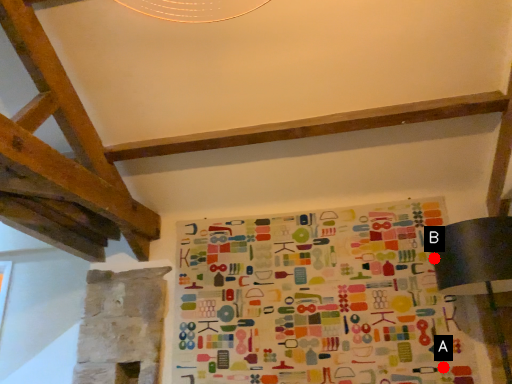
Question: Two points are circled on the image, labeled by A and B beside each circle. Among these points, which one is farthest from the camera?

Choices:
 (A) A is further
 (B) B is further

Answer: (A)